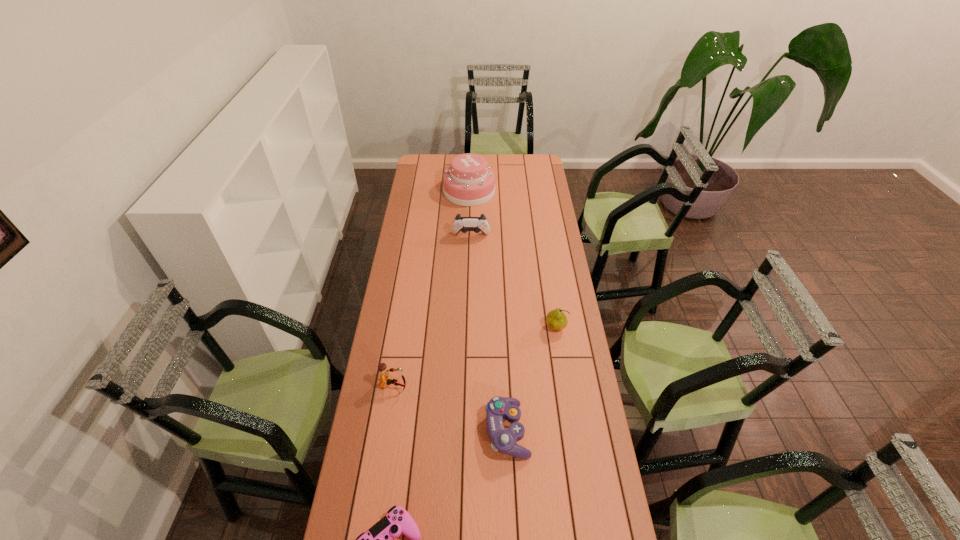
This screenshot has height=540, width=960. Find the location of `vacant space located on the front-facing side of the tallest control`. vacant space located on the front-facing side of the tallest control is located at coordinates (470, 277).

What are the coordinates of `free region located 0.130m on the back of the fourth nearest object` in the screenshot? It's located at (551, 298).

The image size is (960, 540). I want to click on vacant region located holding a crossbow in the hands of the fourth farthest object, so click(463, 386).

Locate an element on the screen. This screenshot has height=540, width=960. vacant area located on the back of the second farthest control is located at coordinates (505, 383).

This screenshot has height=540, width=960. In order to click on object present at the left edge in this screenshot , I will do [385, 378].

You are a GUI agent. You are given a task and a screenshot of the screen. Output one action in this format:
    pyautogui.click(x=<x>, y=<y>)
    Task: Click on the object at the right edge
    This screenshot has height=540, width=960.
    Given the screenshot: What is the action you would take?
    pyautogui.click(x=556, y=319)

Where is `blank space at the far edge`? This screenshot has width=960, height=540. blank space at the far edge is located at coordinates (499, 159).

In order to click on vacant space at the left edge in this screenshot , I will do `click(413, 280)`.

You are a GUI agent. You are given a task and a screenshot of the screen. Output one action in this format:
    pyautogui.click(x=<x>, y=<y>)
    Task: Click on the free space at the right edge of the desktop
    
    Given the screenshot: What is the action you would take?
    pyautogui.click(x=531, y=210)

The image size is (960, 540). Find the location of `free region at the far right corner of the desktop`. free region at the far right corner of the desktop is located at coordinates (529, 170).